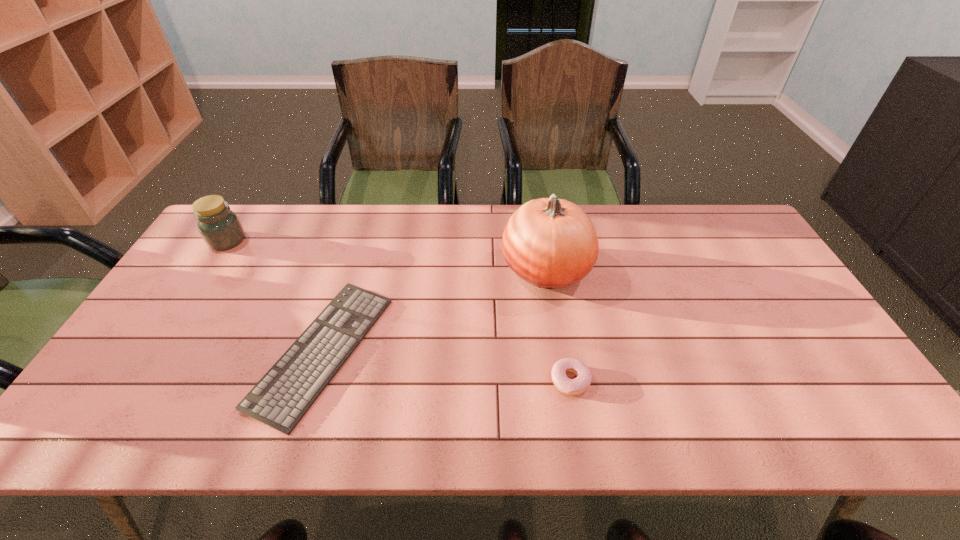
Locate an element on the screen. This screenshot has height=540, width=960. the third closest object relative to the computer keyboard is located at coordinates click(x=580, y=384).

I want to click on vacant area in the image that satisfies the following two spatial constraints: 1. on the front side of the jar; 2. on the right side of the shortest object, so click(x=156, y=351).

The image size is (960, 540). What are the coordinates of `vacant space that satisfies the following two spatial constraints: 1. on the front side of the shortest object; 2. on the right side of the leftmost object` in the screenshot? It's located at (156, 351).

Find the location of a particular element. Image resolution: width=960 pixels, height=540 pixels. blank area in the image that satisfies the following two spatial constraints: 1. on the front side of the tallest object; 2. on the right side of the doughnut is located at coordinates (564, 380).

What are the coordinates of `free space that satisfies the following two spatial constraints: 1. on the front side of the second tallest object; 2. on the right side of the second shortest object` in the screenshot? It's located at (137, 380).